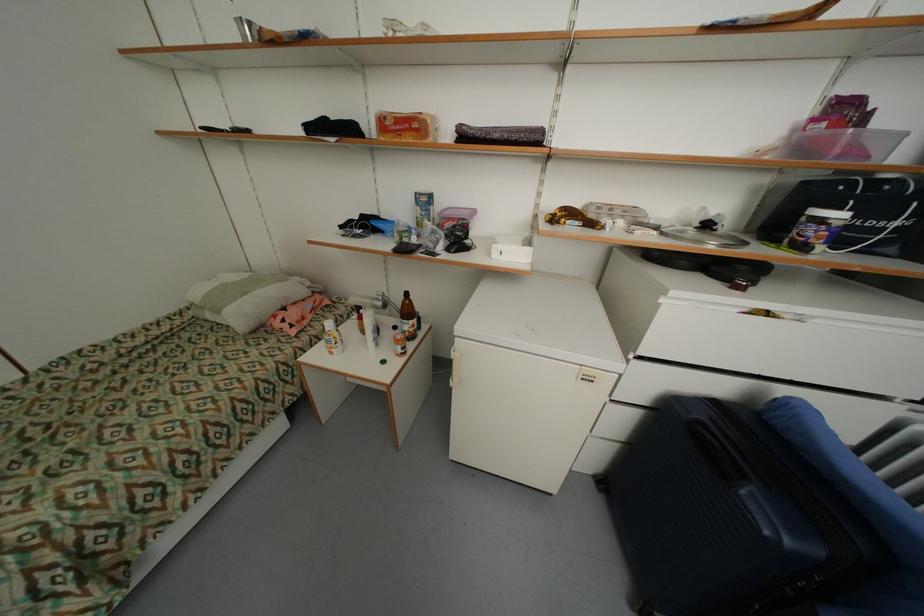
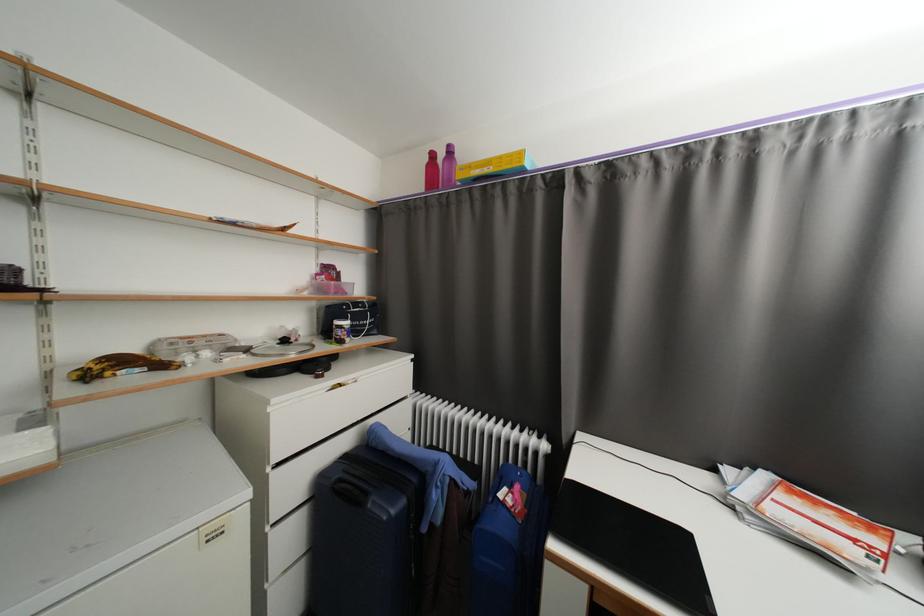
Locate, in the second image, the point that corresponds to point (713, 227) in the first image.

(290, 342)